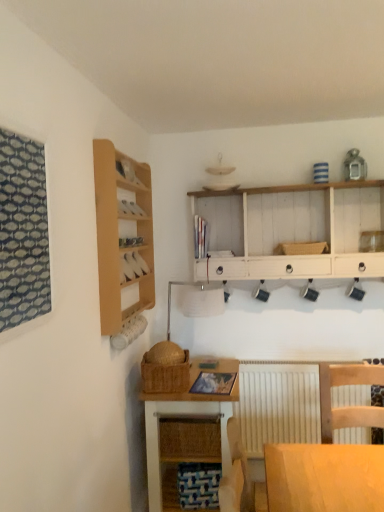
Question: Considering the relative sizes of wooden cabinet at upper left and white painted wood shelf at upper center in the image provided, is wooden cabinet at upper left wider than white painted wood shelf at upper center?

Choices:
 (A) no
 (B) yes

Answer: (A)

Question: Can you confirm if wooden cabinet at upper left is shorter than white painted wood shelf at upper center?

Choices:
 (A) no
 (B) yes

Answer: (B)

Question: Can you confirm if wooden cabinet at upper left is smaller than white painted wood shelf at upper center?

Choices:
 (A) yes
 (B) no

Answer: (A)

Question: From the image's perspective, is wooden cabinet at upper left located beneath white painted wood shelf at upper center?

Choices:
 (A) yes
 (B) no

Answer: (A)

Question: From a real-world perspective, is wooden cabinet at upper left beneath white painted wood shelf at upper center?

Choices:
 (A) yes
 (B) no

Answer: (A)

Question: Is white matte radiator at lower center wider or thinner than woven straw basket at center, the 1th basket viewed from the right?

Choices:
 (A) wide
 (B) thin

Answer: (B)

Question: In the image, is white matte radiator at lower center on the left side or the right side of woven straw basket at center, which appears as the 2th basket when viewed from the left?

Choices:
 (A) right
 (B) left

Answer: (B)

Question: Is white matte radiator at lower center taller or shorter than woven straw basket at center, which appears as the 2th basket when viewed from the left?

Choices:
 (A) tall
 (B) short

Answer: (A)

Question: Based on their sizes in the image, would you say white matte radiator at lower center is bigger or smaller than woven straw basket at center, the 1th basket viewed from the right?

Choices:
 (A) small
 (B) big

Answer: (B)

Question: Is light wood shelf at left taller or shorter than woven brown basket at lower center, marked as the 1th basket in a front-to-back arrangement?

Choices:
 (A) short
 (B) tall

Answer: (B)

Question: Do you think light wood shelf at left is within woven brown basket at lower center, the 2th basket when ordered from back to front, or outside of it?

Choices:
 (A) outside
 (B) inside

Answer: (A)

Question: Does point (97, 162) appear closer or farther from the camera than point (173, 372)?

Choices:
 (A) farther
 (B) closer

Answer: (B)

Question: In terms of width, does light wood shelf at left look wider or thinner when compared to woven brown basket at lower center, which is the 1th basket from left to right?

Choices:
 (A) thin
 (B) wide

Answer: (A)

Question: Considering their positions, is white painted wood shelf at upper center located in front of or behind patterned fabric window at left?

Choices:
 (A) front
 (B) behind

Answer: (B)

Question: Do you think white painted wood shelf at upper center is within patterned fabric window at left, or outside of it?

Choices:
 (A) inside
 (B) outside

Answer: (B)